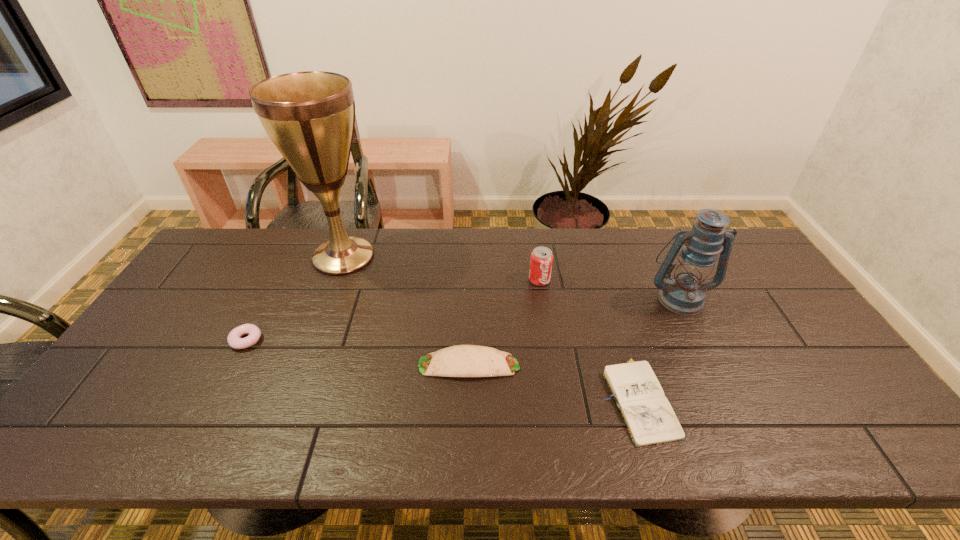
Find the location of a particular element. The height and width of the screenshot is (540, 960). free space at the right edge is located at coordinates (764, 274).

Find the location of `vacant space at the far left corner`. vacant space at the far left corner is located at coordinates (221, 259).

In the image, there is a desktop. At what (x,y) coordinates should I click in order to perform the action: click on vacant region at the far right corner. Please return your answer as a coordinate pair (x, y). Looking at the image, I should click on (752, 267).

Where is `unoccupied area between the leftmost object and the third object from right to left`? unoccupied area between the leftmost object and the third object from right to left is located at coordinates (393, 310).

This screenshot has width=960, height=540. I want to click on vacant space in between the tallest object and the fourth shortest object, so click(x=442, y=268).

Identify the location of free space between the burrito and the fifth object from left to right. (553, 382).

Where is `free point between the trophy cup and the lantern`? This screenshot has height=540, width=960. free point between the trophy cup and the lantern is located at coordinates point(512,277).

Find the location of a particular element. Image resolution: width=960 pixels, height=540 pixels. vacant point located between the tallest object and the third object from right to left is located at coordinates (442, 268).

Image resolution: width=960 pixels, height=540 pixels. I want to click on free spot between the burrito and the doughnut, so click(x=358, y=353).

The image size is (960, 540). I want to click on vacant area that lies between the leftmost object and the trophy cup, so click(295, 298).